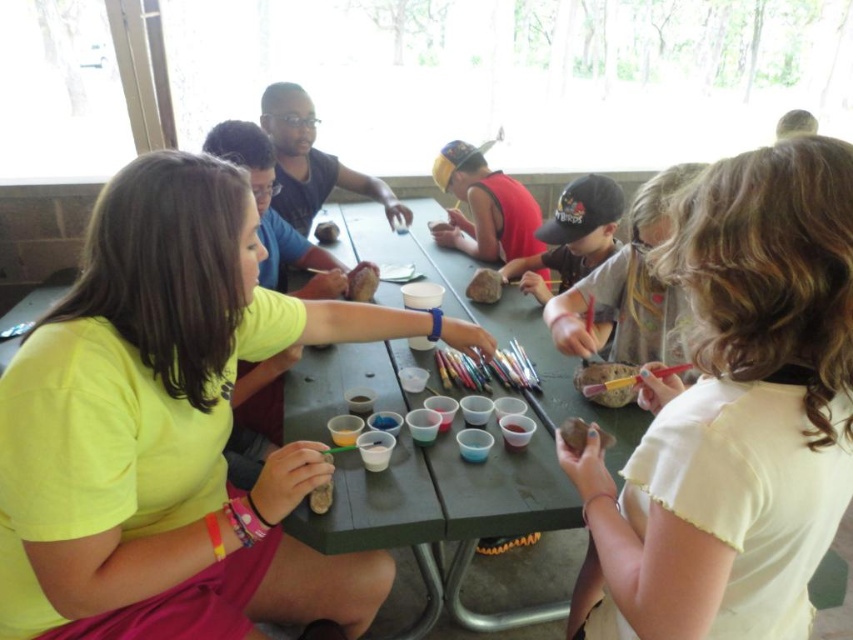
Question: Does yellow matte shirt at center lie in front of matte black cap at center?

Choices:
 (A) yes
 (B) no

Answer: (A)

Question: Is the position of smooth brown rock at center more distant than that of brown matte rock at lower center?

Choices:
 (A) no
 (B) yes

Answer: (B)

Question: Which point appears farthest from the camera in this image?

Choices:
 (A) (315, 509)
 (B) (549, 236)
 (C) (596, 396)
 (D) (329, 230)

Answer: (D)

Question: Does matte black shirt at center have a greater width compared to yellow matte paintbrush at center?

Choices:
 (A) no
 (B) yes

Answer: (B)

Question: Which point is closer to the camera?

Choices:
 (A) (602, 378)
 (B) (177, 152)
 (C) (465, 291)
 (D) (328, 221)

Answer: (B)

Question: Among these objects, which one is nearest to the camera?

Choices:
 (A) brown matte rock at lower center
 (B) matte black cap at center
 (C) matte black shirt at center

Answer: (A)